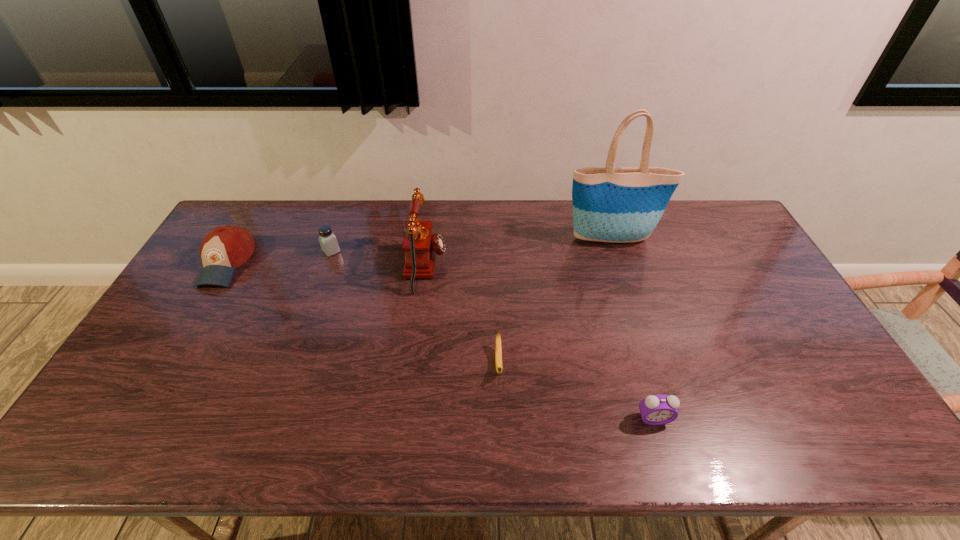
In the image, there is a desktop. Identify the location of vacant space at the far edge. (427, 210).

The width and height of the screenshot is (960, 540). I want to click on free region at the near edge, so click(x=372, y=449).

Image resolution: width=960 pixels, height=540 pixels. In the image, there is a desktop. What are the coordinates of `vacant space at the far right corner` in the screenshot? It's located at (716, 217).

Where is `free location at the near right corner`? free location at the near right corner is located at coordinates (840, 444).

I want to click on free space between the tote bag and the alarm clock, so click(x=633, y=329).

Where is `vacant space that's between the tallest object and the shortest object`? The width and height of the screenshot is (960, 540). vacant space that's between the tallest object and the shortest object is located at coordinates pyautogui.click(x=555, y=301).

I want to click on vacant area that lies between the fourth object from left to right and the nearest object, so click(576, 390).

The height and width of the screenshot is (540, 960). I want to click on unoccupied position between the tote bag and the second tallest object, so click(x=518, y=253).

Locate an element on the screen. Image resolution: width=960 pixels, height=540 pixels. blank region between the fifth object from right to left and the leftmost object is located at coordinates (279, 257).

Where is `free point between the telephone and the leftmost object`? The height and width of the screenshot is (540, 960). free point between the telephone and the leftmost object is located at coordinates (326, 265).